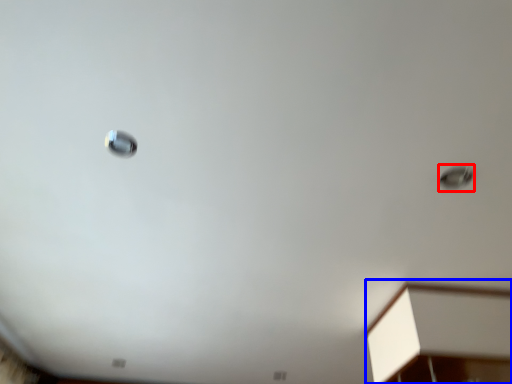
Question: Which object is further to the camera taking this photo, droplight (highlighted by a red box) or furniture (highlighted by a blue box)?

Choices:
 (A) droplight
 (B) furniture

Answer: (B)